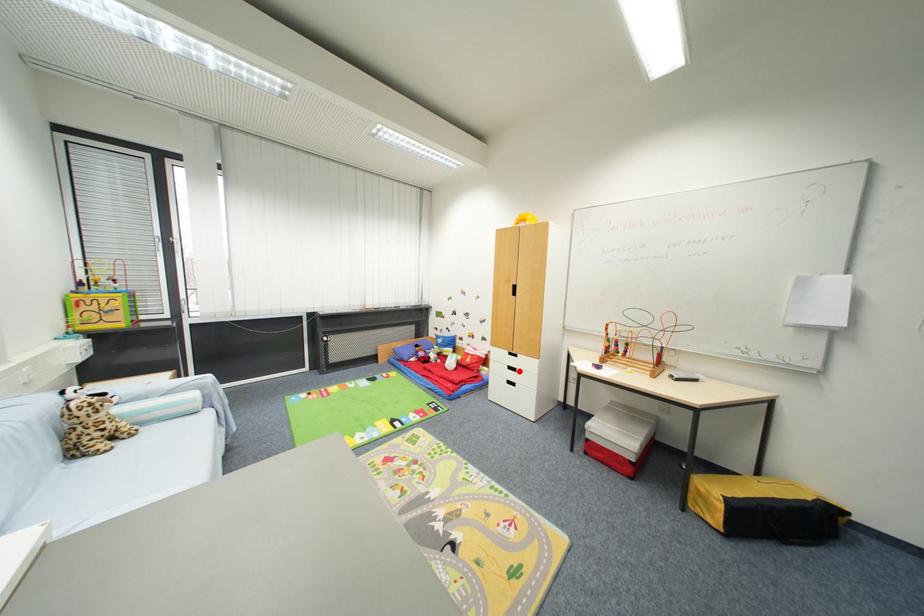
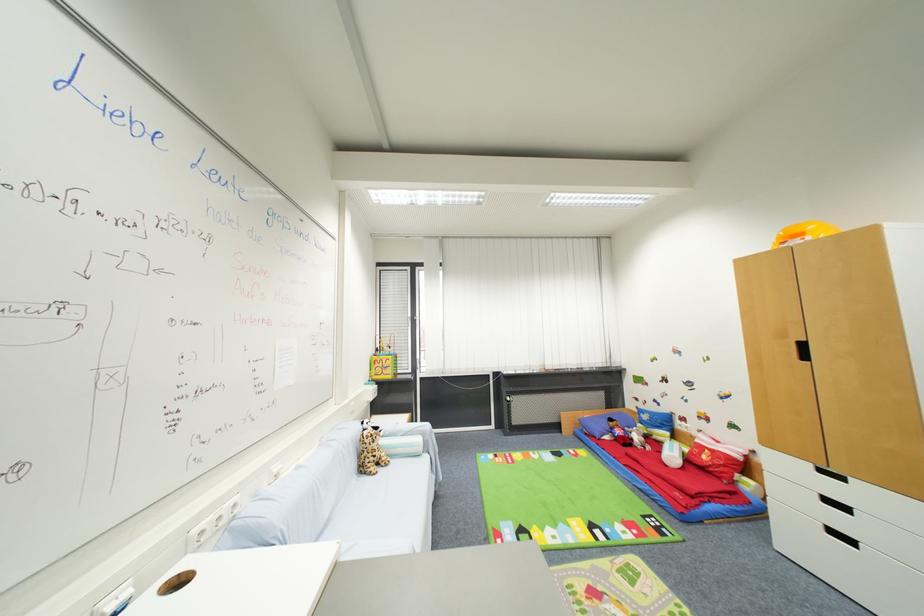
Question: I am providing you with two images of the same scene from different viewpoints. Given a red point in image1, look at the same physical point in image2. Is it:

Choices:
 (A) Closer to the viewpoint
 (B) Farther from the viewpoint

Answer: (A)